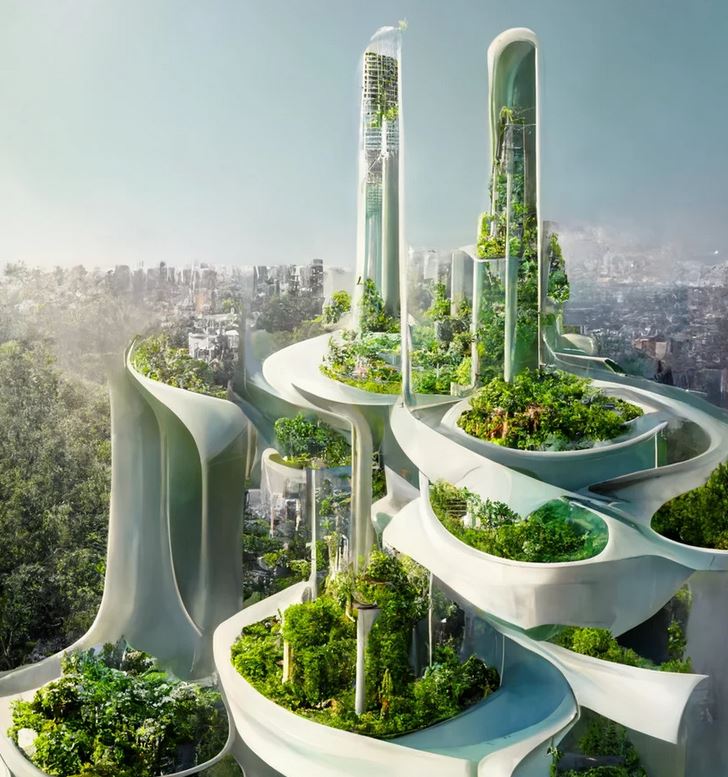
Find the location of a particular element. windows is located at coordinates (378, 57).